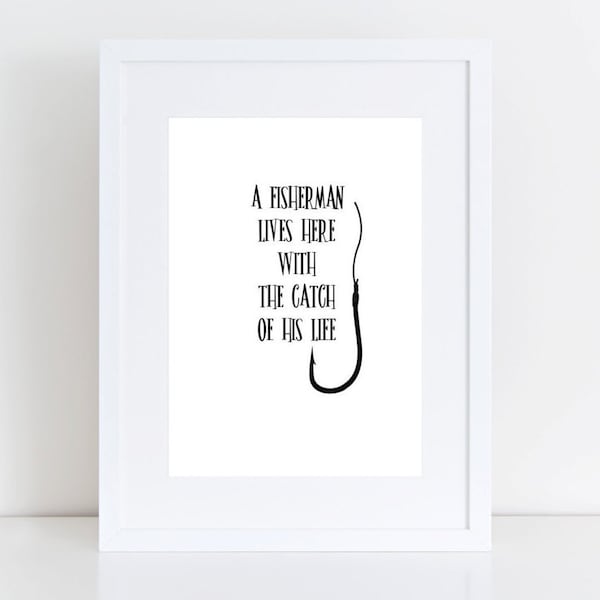
You are a GUI agent. You are given a task and a screenshot of the screen. Output one action in this format:
    pyautogui.click(x=<x>, y=<y>)
    Task: Click on the side of frame
    This screenshot has height=600, width=600.
    Given the screenshot: What is the action you would take?
    pyautogui.click(x=111, y=432), pyautogui.click(x=481, y=439)